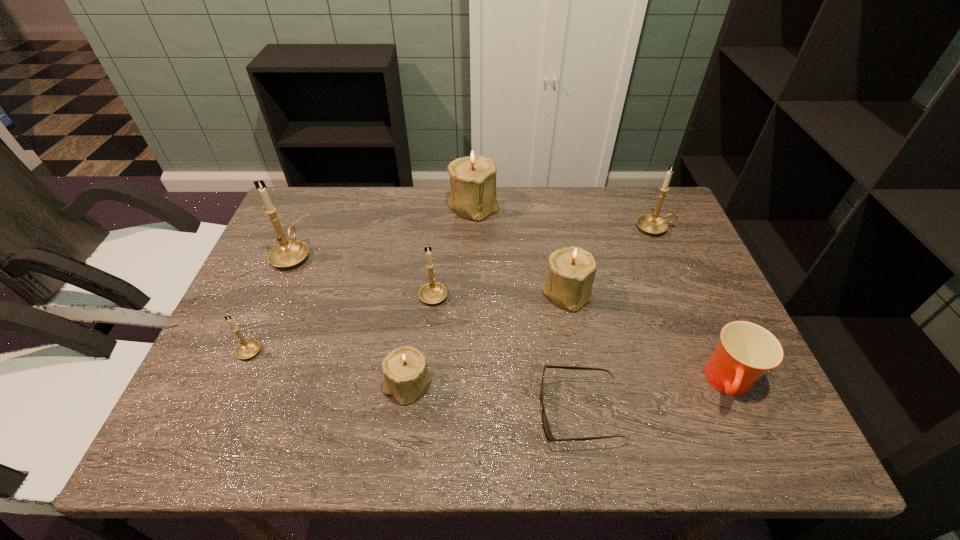
Find the location of a particular element. This screenshot has height=540, width=960. the second nearest candle_holder is located at coordinates (246, 349).

I want to click on the nearest gold candle holder, so click(246, 349).

Where is `the leftmost beige candle_holder`? This screenshot has height=540, width=960. the leftmost beige candle_holder is located at coordinates (406, 378).

I want to click on the nearest beige candle_holder, so click(x=406, y=378).

Locate an element on the screen. cup is located at coordinates tap(746, 351).

The image size is (960, 540). I want to click on sunglasses, so click(x=545, y=423).

This screenshot has height=540, width=960. I want to click on free spot located 0.180m on the handle side of the biggest gold candle holder, so click(x=316, y=201).

The image size is (960, 540). I want to click on blank area located 0.070m on the handle side of the biggest gold candle holder, so click(x=306, y=223).

This screenshot has height=540, width=960. Find the location of `vacant region located on the handle side of the biggest gold candle holder`. vacant region located on the handle side of the biggest gold candle holder is located at coordinates (311, 211).

At what (x,y) coordinates should I click in order to perform the action: click on vacant area situated 0.210m on the left of the second beige candle_holder from left to right. Please return your answer as a coordinate pair (x, y). Looking at the image, I should click on (381, 205).